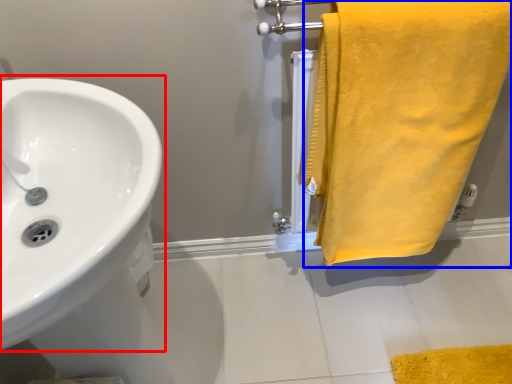
Question: Among these objects, which one is nearest to the camera, sink (highlighted by a red box) or towel (highlighted by a blue box)?

Choices:
 (A) sink
 (B) towel

Answer: (A)